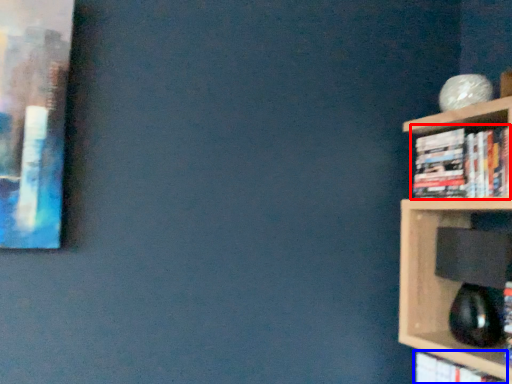
Question: Among these objects, which one is nearest to the camera, book (highlighted by a red box) or book (highlighted by a blue box)?

Choices:
 (A) book
 (B) book

Answer: (B)